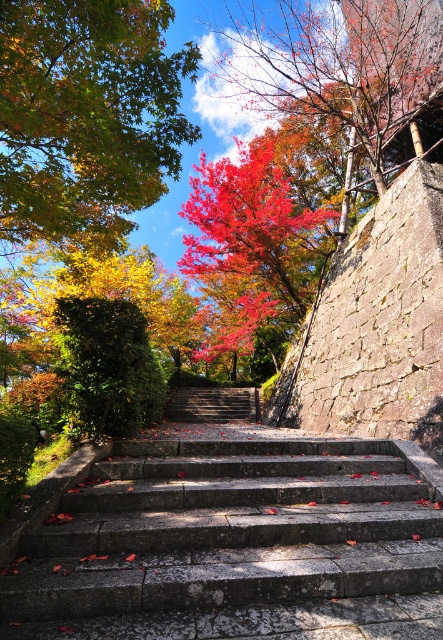
Is gray stone stairs at center positioned at the back of shiny red leaves at upper center?

No, gray stone stairs at center is in front of shiny red leaves at upper center.

Who is taller, gray stone stairs at center or shiny red leaves at upper center?

shiny red leaves at upper center is taller.

Is point (159, 552) more distant than point (283, 12)?

No.

Locate an element on the screen. gray stone stairs at center is located at coordinates (234, 541).

Is point (217, 499) farther from camera compared to point (113, 170)?

No, it is in front of (113, 170).

Who is taller, gray stone stairs at center or shiny red maple leaves at upper center?

Standing taller between the two is shiny red maple leaves at upper center.

Which is behind, point (345, 598) or point (8, 115)?

The point (8, 115) is behind.

This screenshot has width=443, height=640. I want to click on gray stone stairs at center, so click(x=234, y=541).

Does shiny red maple leaves at upper center lie behind vivid red leaves at center?

That is False.

At what (x,y) coordinates should I click in order to perform the action: click on shiny red maple leaves at upper center. Please return your answer as a coordinate pair (x, y). This screenshot has height=640, width=443. Looking at the image, I should click on (86, 115).

Where is `shiny red maple leaves at upper center`? This screenshot has width=443, height=640. shiny red maple leaves at upper center is located at coordinates (86, 115).